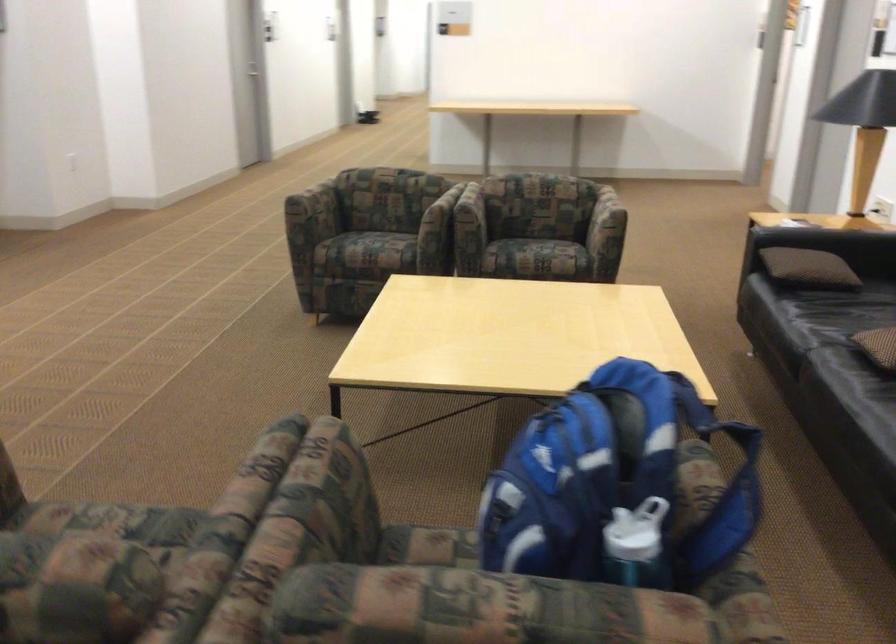
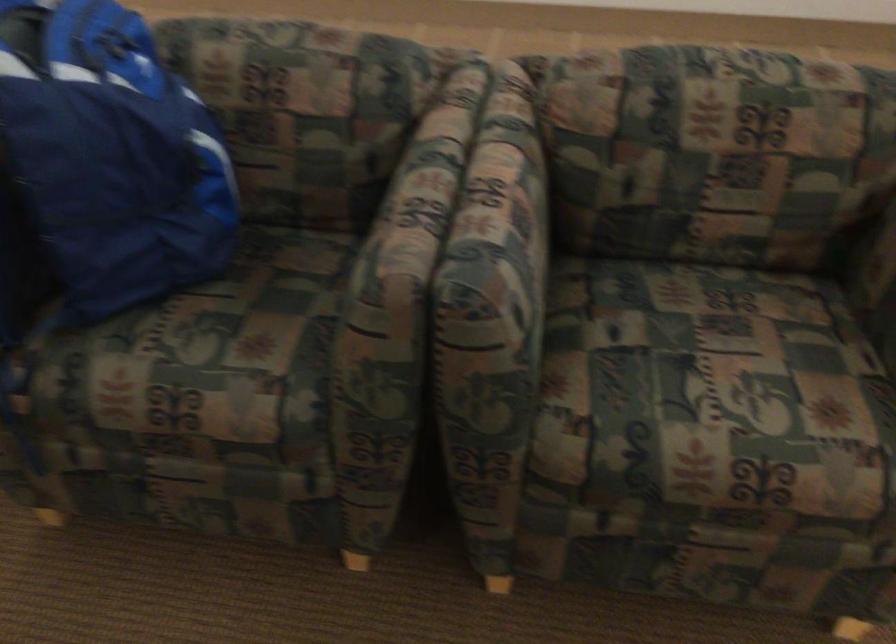
Locate, in the second image, the point that corresponds to point (312, 455) in the first image.

(412, 207)